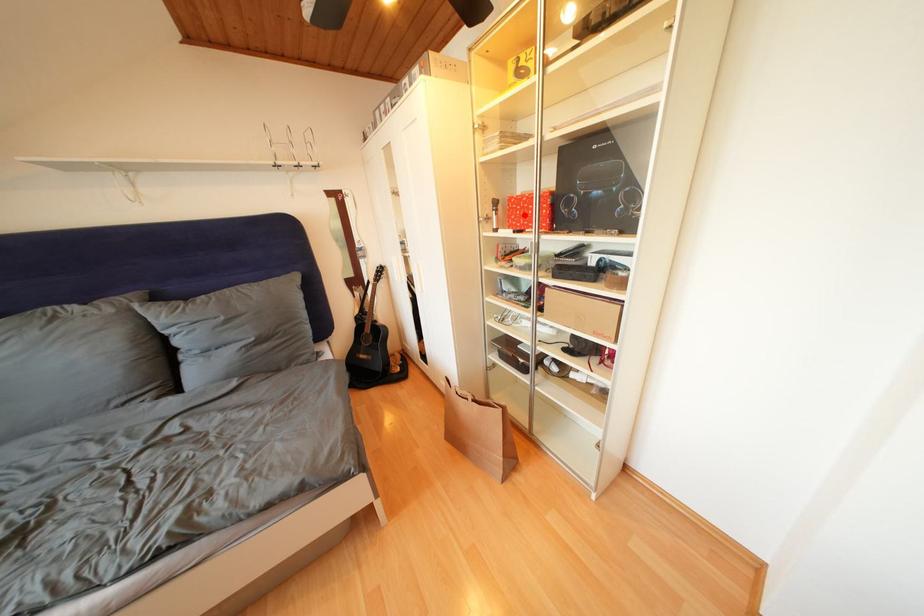
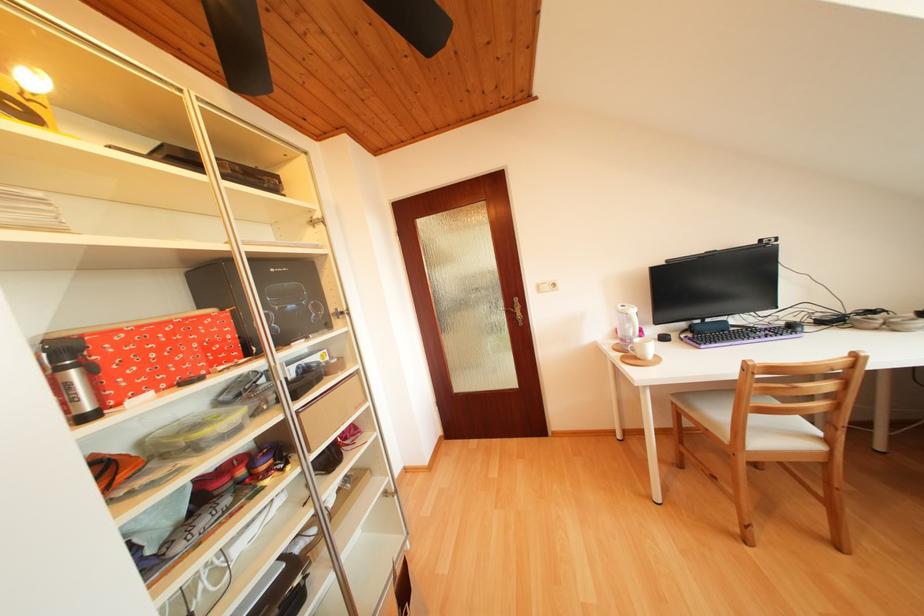
Locate, in the second image, the point that corresponds to the highlighted location in the first image.

(151, 358)